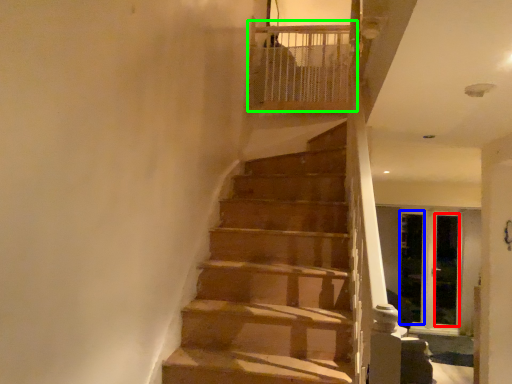
Question: Which object is positioned farthest from screen door (highlighted by a red box)? Select from screen door (highlighted by a blue box) and balustrade (highlighted by a green box).

Choices:
 (A) screen door
 (B) balustrade

Answer: (B)